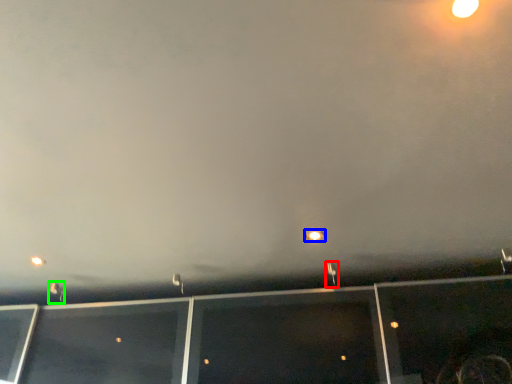
Question: Considering the real-world distances, which object is farthest from street light (highlighted by a red box)? street light (highlighted by a blue box) or street light (highlighted by a green box)?

Choices:
 (A) street light
 (B) street light

Answer: (B)